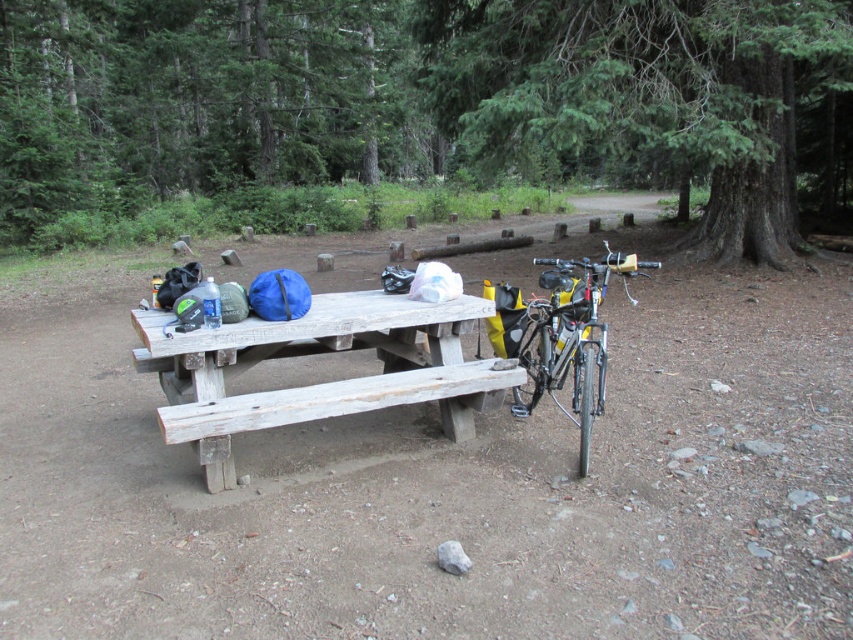
Question: Which of these objects is positioned closest to the shiny metallic bicycle at right?

Choices:
 (A) green textured tree at upper right
 (B) green textured tree at upper center

Answer: (A)

Question: From the image, what is the correct spatial relationship of green textured tree at upper center in relation to weathered wood picnic table at center?

Choices:
 (A) above
 (B) below

Answer: (A)

Question: Among these points, which one is farthest from the camera?

Choices:
 (A) (780, 24)
 (B) (294, 401)

Answer: (A)

Question: Is green textured tree at upper center closer to the viewer compared to shiny metallic bicycle at right?

Choices:
 (A) no
 (B) yes

Answer: (A)

Question: Which point is closer to the camera taking this photo?

Choices:
 (A) (134, 172)
 (B) (398, 364)
 (C) (544, 92)

Answer: (B)

Question: From the image, what is the correct spatial relationship of weathered wood picnic table at center in relation to shiny metallic bicycle at right?

Choices:
 (A) below
 (B) above

Answer: (B)